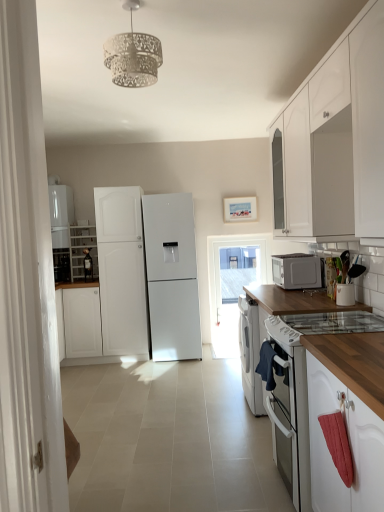
Question: Is satin silver microwave at right closer to camera compared to white glossy cabinet at upper right, the 2th cabinetry positioned from the left?

Choices:
 (A) yes
 (B) no

Answer: (B)

Question: Considering the relative sizes of satin silver microwave at right and white glossy cabinet at upper right, the 2th cabinetry positioned from the left, in the image provided, is satin silver microwave at right thinner than white glossy cabinet at upper right, the 2th cabinetry positioned from the left,?

Choices:
 (A) yes
 (B) no

Answer: (A)

Question: Is satin silver microwave at right at the left side of white glossy cabinet at upper right, which ranks as the second cabinetry in back-to-front order?

Choices:
 (A) yes
 (B) no

Answer: (B)

Question: From the image's perspective, would you say satin silver microwave at right is positioned over white glossy cabinet at upper right, marked as the 1th cabinetry in a front-to-back arrangement?

Choices:
 (A) no
 (B) yes

Answer: (A)

Question: Does satin silver microwave at right appear on the right side of white glossy cabinet at upper right, the 2th cabinetry positioned from the left?

Choices:
 (A) no
 (B) yes

Answer: (B)

Question: Is satin silver microwave at right far away from white glossy cabinet at upper right, marked as the 1th cabinetry in a front-to-back arrangement?

Choices:
 (A) yes
 (B) no

Answer: (B)

Question: Are white wood cabinet at left, the 1th cabinetry positioned from the left, and white matte refrigerator at left, which is the second refrigerator from right to left, located far from each other?

Choices:
 (A) no
 (B) yes

Answer: (A)

Question: Could white matte refrigerator at left, the 1th refrigerator from the left, be considered to be inside white wood cabinet at left, the 1th cabinetry positioned from the left?

Choices:
 (A) no
 (B) yes

Answer: (A)

Question: From a real-world perspective, does white wood cabinet at left, acting as the second cabinetry starting from the right, sit lower than white matte refrigerator at left, the 1th refrigerator from the left?

Choices:
 (A) yes
 (B) no

Answer: (A)

Question: Does white wood cabinet at left, the first cabinetry when ordered from back to front, have a greater width compared to white matte refrigerator at left, which is the second refrigerator from right to left?

Choices:
 (A) no
 (B) yes

Answer: (B)

Question: Is white wood cabinet at left, the first cabinetry when ordered from back to front, thinner than white matte refrigerator at left, which is the second refrigerator from right to left?

Choices:
 (A) yes
 (B) no

Answer: (B)

Question: Considering the relative sizes of white wood cabinet at left, the first cabinetry when ordered from back to front, and white matte refrigerator at left, the 1th refrigerator from the left, in the image provided, is white wood cabinet at left, the first cabinetry when ordered from back to front, taller than white matte refrigerator at left, the 1th refrigerator from the left,?

Choices:
 (A) yes
 (B) no

Answer: (B)

Question: From the image's perspective, is white glass gas stove at lower right under wooden at right?

Choices:
 (A) yes
 (B) no

Answer: (B)